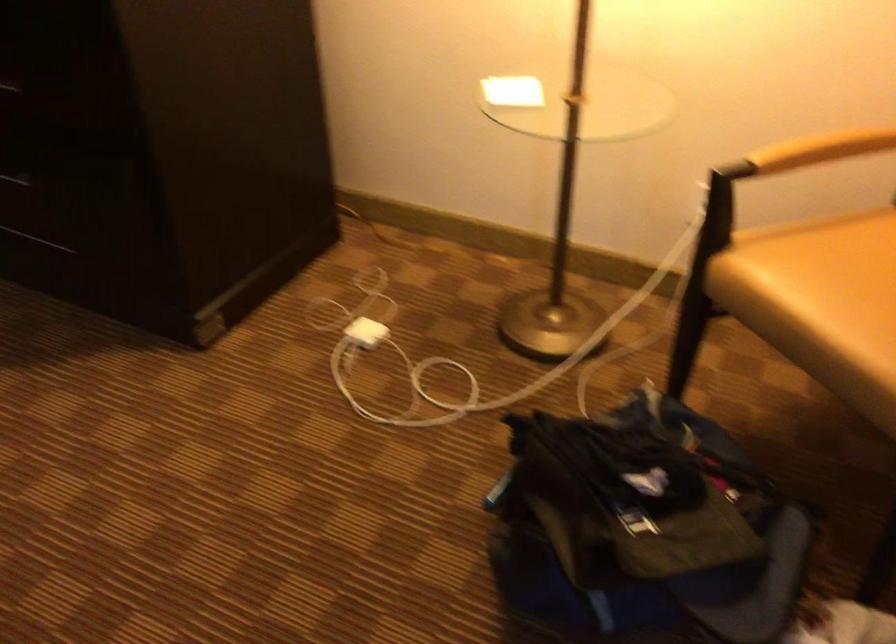
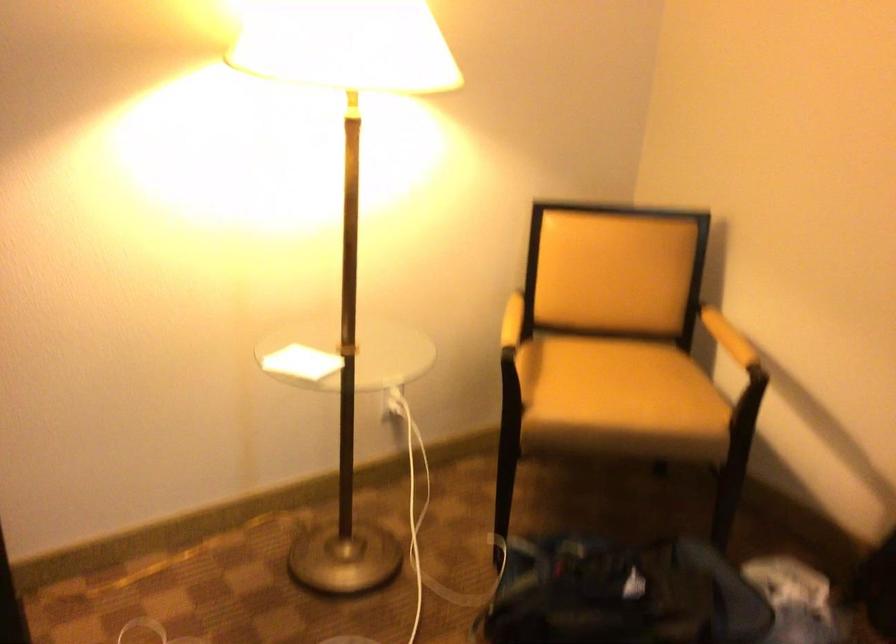
Locate, in the second image, the point that corresponds to (x=821, y=149) in the first image.

(528, 319)